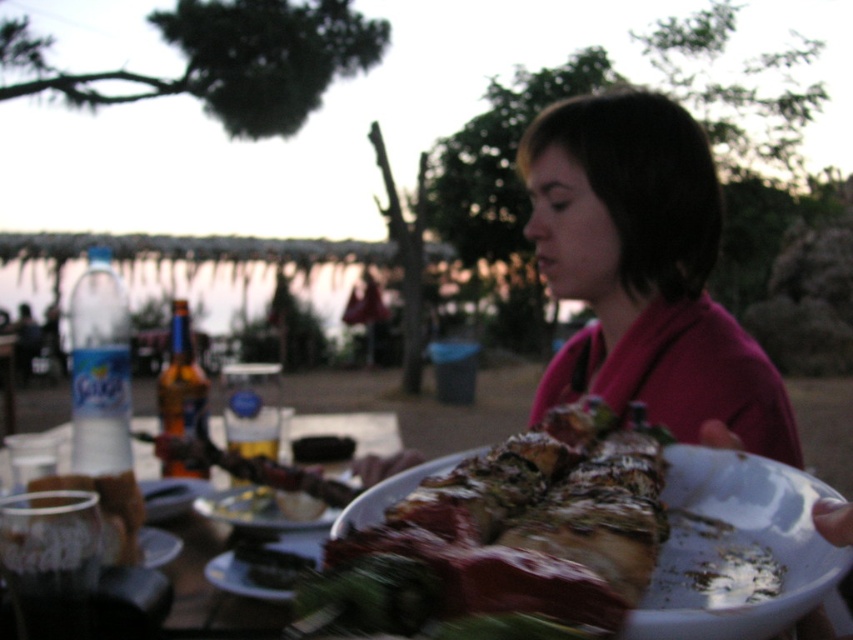
Question: From the image, what is the correct spatial relationship of white glossy plate at center in relation to translucent glass cup at lower left?

Choices:
 (A) above
 (B) below

Answer: (B)

Question: Is pink fabric at center to the left of white glossy plate at center from the viewer's perspective?

Choices:
 (A) no
 (B) yes

Answer: (A)

Question: Which point is farther to the camera?

Choices:
 (A) (108, 541)
 (B) (152, 556)
 (C) (564, 492)

Answer: (B)

Question: Which object is closer to the camera taking this photo?

Choices:
 (A) shiny metallic roast at center
 (B) translucent glass cup at lower left

Answer: (A)

Question: From the image, what is the correct spatial relationship of shiny metallic roast at center in relation to translucent glass cup at lower left?

Choices:
 (A) left
 (B) right

Answer: (B)

Question: Which point is closer to the camera taking this photo?

Choices:
 (A) (490, 529)
 (B) (105, 563)
 (C) (292, 496)

Answer: (A)